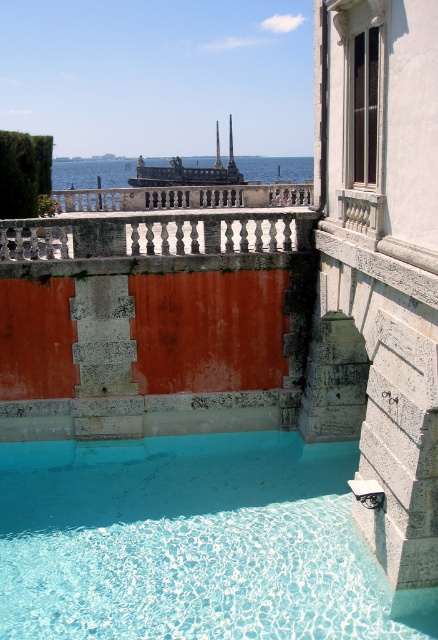
Is white stone balustrade at upper center positioned at the back of blue water at center?

No.

Is point (116, 252) closer to viewer compared to point (286, 188)?

Yes, it is in front of point (286, 188).

Is point (77, 220) farther from camera compared to point (214, 193)?

No, it is not.

This screenshot has height=640, width=438. Identify the location of white stone balustrade at upper center. (155, 236).

Which is in front, point (257, 502) or point (145, 200)?

Point (257, 502) is more forward.

Does clear glass swimming pool at lower center have a larger size compared to blue water at center?

No.

Is point (45, 547) less distant than point (52, 179)?

Yes, point (45, 547) is in front of point (52, 179).

You are a GUI agent. You are given a task and a screenshot of the screen. Output one action in this format:
    pyautogui.click(x=<x>, y=<y>)
    Task: Click on the clear glass swimming pool at lower center
    The height and width of the screenshot is (640, 438).
    Given the screenshot: What is the action you would take?
    pyautogui.click(x=191, y=541)

Who is higher up, clear glass swimming pool at lower center or white stone balustrade at upper center?

white stone balustrade at upper center

Does clear glass swimming pool at lower center appear under white stone balustrade at upper center?

Correct, clear glass swimming pool at lower center is located below white stone balustrade at upper center.

Identify the location of clear glass swimming pool at lower center. This screenshot has height=640, width=438. click(x=191, y=541).